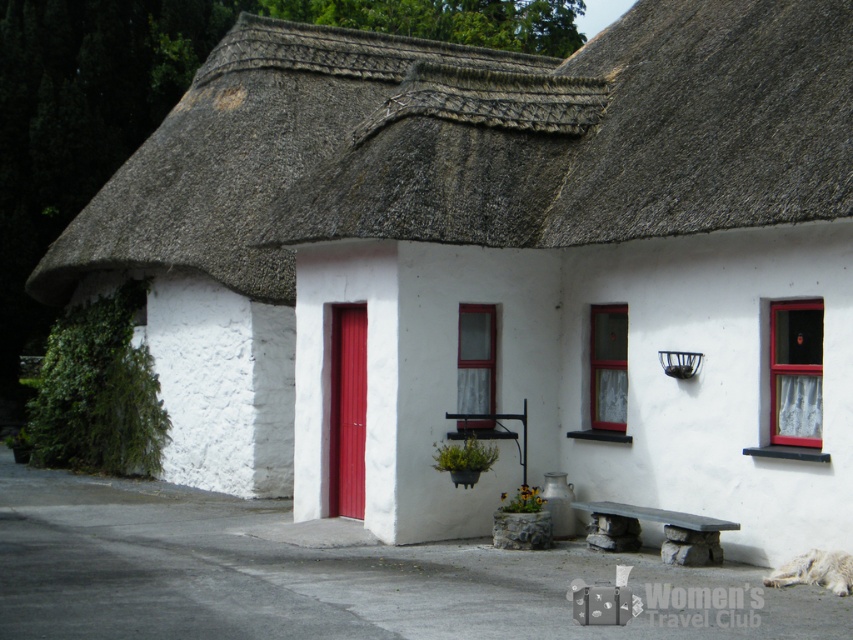
Question: Which of these objects is positioned farthest from the matte glass window at center?

Choices:
 (A) matte glass window at upper right
 (B) smooth stone bench at center
 (C) clear glass window at center

Answer: (A)

Question: Estimate the real-world distances between objects in this image. Which object is farther from the matte glass window at center?

Choices:
 (A) smooth stone bench at center
 (B) matte glass window at upper right

Answer: (B)

Question: Where is matte glass window at upper right located in relation to clear glass window at center in the image?

Choices:
 (A) left
 (B) right

Answer: (B)

Question: Can you confirm if matte glass window at upper right is positioned above matte glass window at center?

Choices:
 (A) yes
 (B) no

Answer: (A)

Question: Considering the real-world distances, which object is farthest from the matte glass window at upper right?

Choices:
 (A) matte glass window at center
 (B) clear glass window at center

Answer: (B)

Question: Can you confirm if clear glass window at center is bigger than smooth stone bench at center?

Choices:
 (A) yes
 (B) no

Answer: (B)